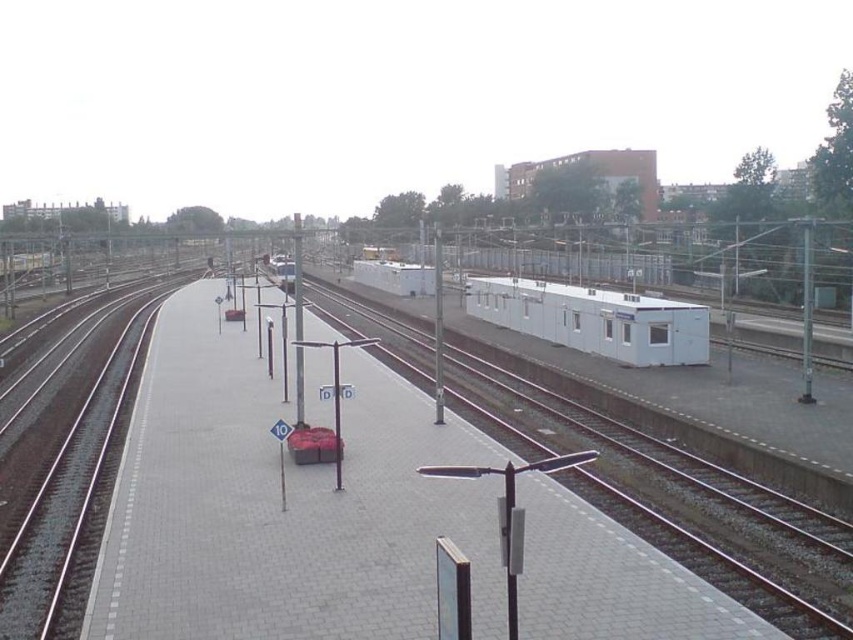
Does metal train track at center have a lesser width compared to white matte container at center?

Incorrect, metal train track at center's width is not less than white matte container at center's.

Where is `metal train track at center`? This screenshot has height=640, width=853. metal train track at center is located at coordinates (676, 500).

Where is `smooth concrete train track at left`? Image resolution: width=853 pixels, height=640 pixels. smooth concrete train track at left is located at coordinates (65, 452).

Based on the photo, can you confirm if smooth concrete train track at left is bigger than white matte container at center?

Yes, smooth concrete train track at left is bigger than white matte container at center.

Between point (178, 285) and point (663, 300), which one is positioned behind?

Positioned behind is point (178, 285).

Find the location of a particular element. smooth concrete train track at left is located at coordinates (65, 452).

Is metal train track at center wider than smooth concrete train track at left?

Incorrect, metal train track at center's width does not surpass smooth concrete train track at left's.

Is point (833, 595) positioned after point (119, 365)?

No, it is not.

You are a GUI agent. You are given a task and a screenshot of the screen. Output one action in this format:
    pyautogui.click(x=<x>, y=<y>)
    Task: Click on the metal train track at center
    This screenshot has height=640, width=853.
    Given the screenshot: What is the action you would take?
    pyautogui.click(x=676, y=500)